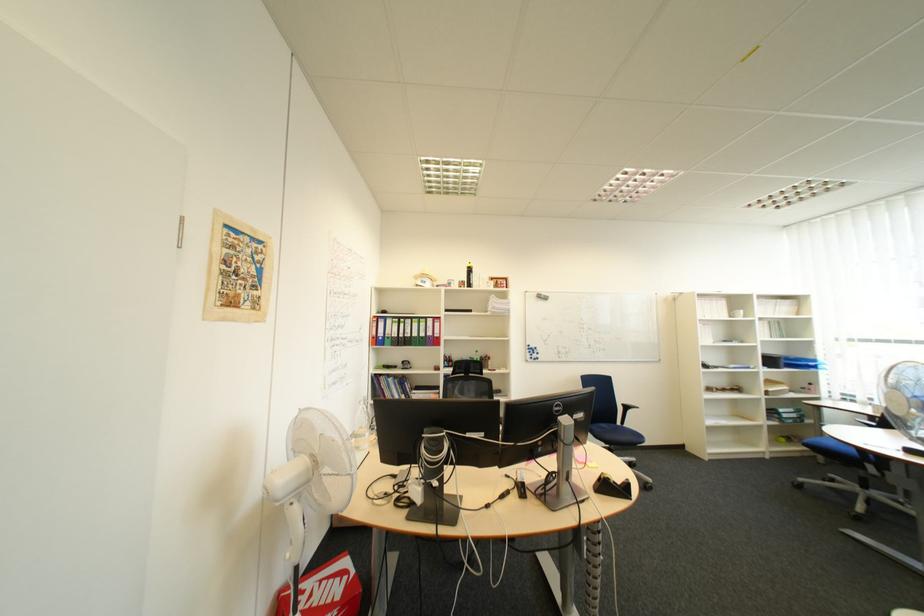
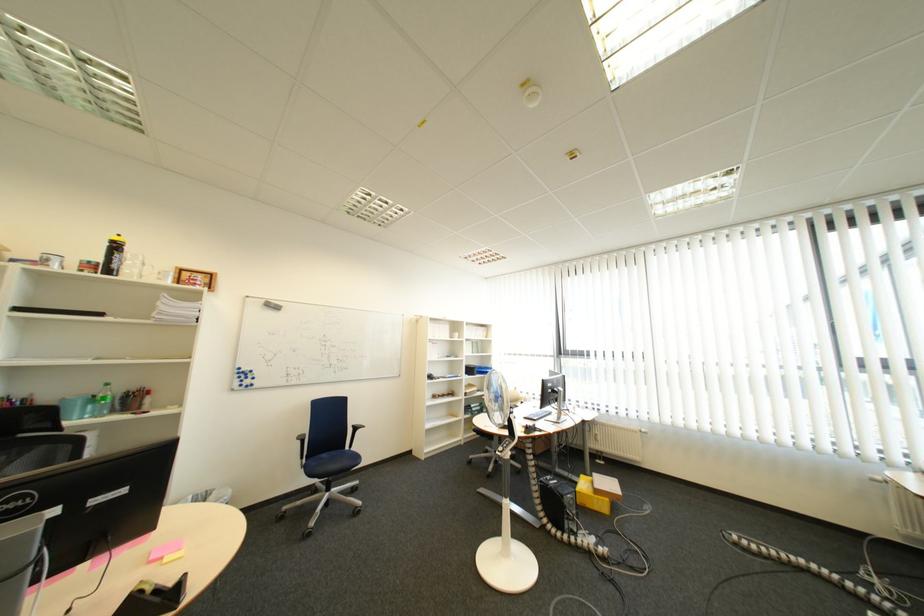
In the second image, find the point that corresponds to the point at 616,427 in the first image.

(337, 456)